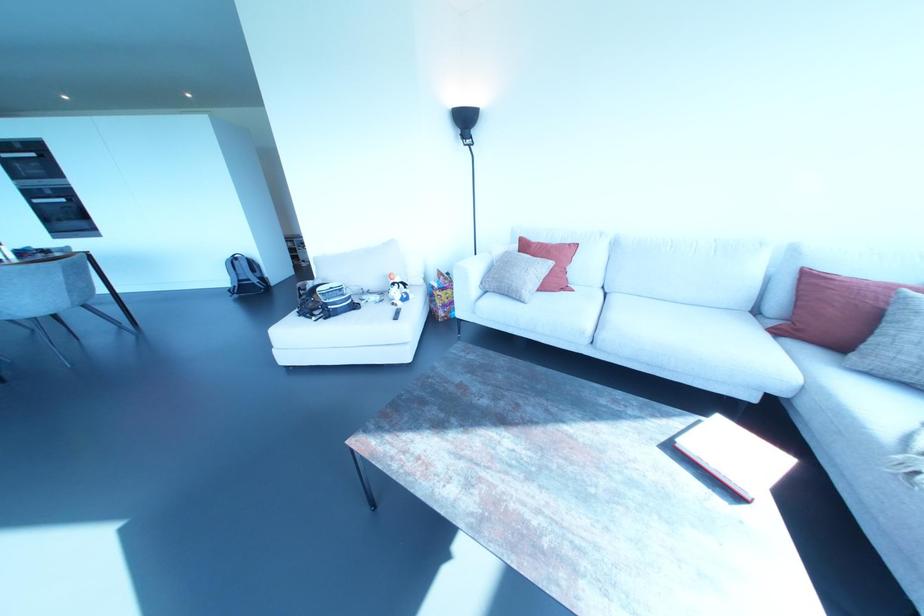
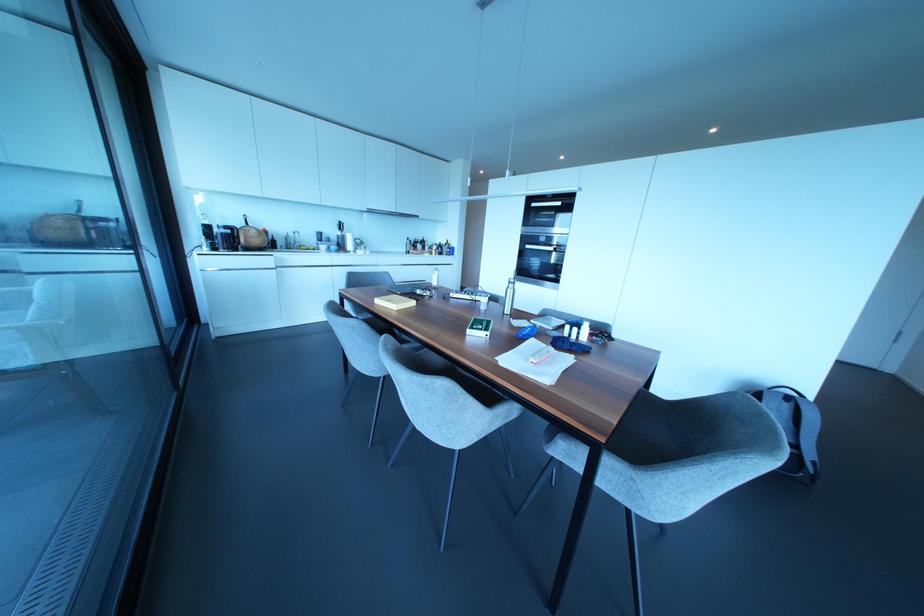
Where in the second image is the point corresponding to pixel 68 200 from the first image?

(553, 248)